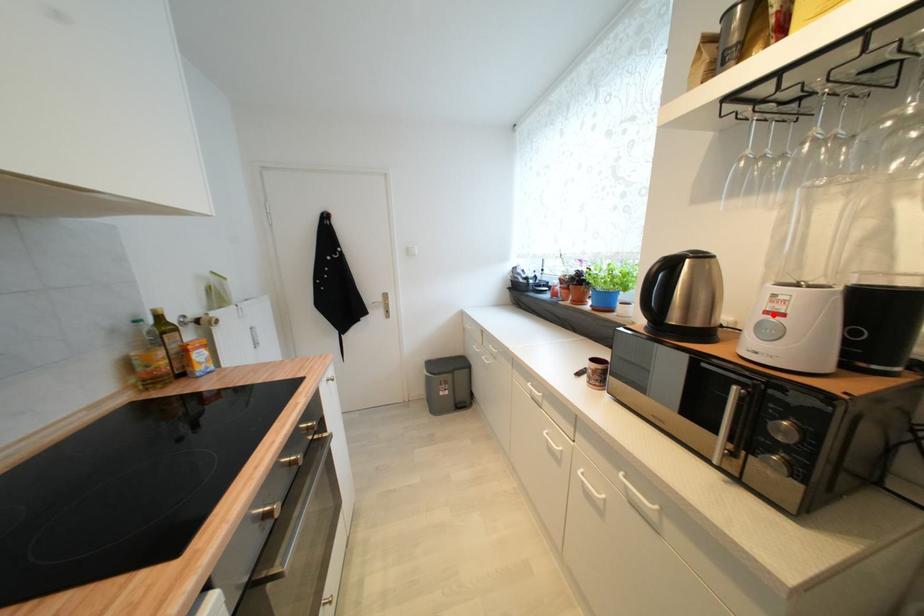
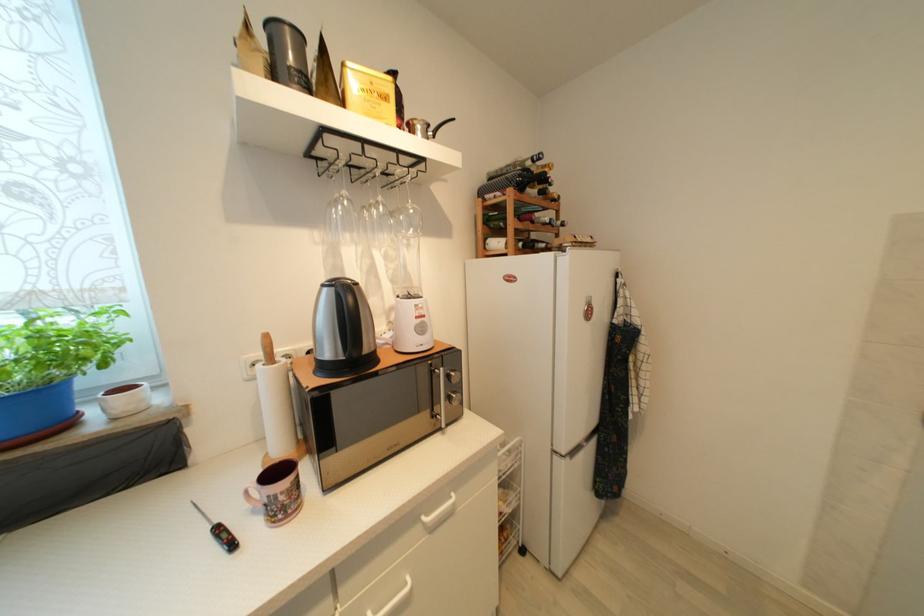
The point at the highlighted location is marked in the first image. Where is the corresponding point in the second image?

(421, 320)